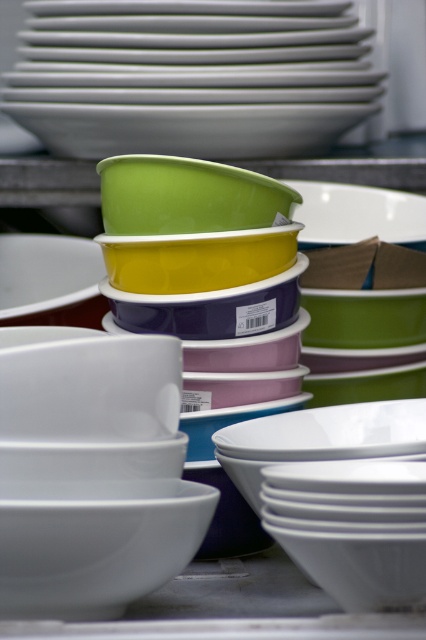
Is matte green bowl at upper center wider than white glossy bowl at center?

Yes, matte green bowl at upper center is wider than white glossy bowl at center.

Between matte green bowl at upper center and white glossy bowl at center, which one has more height?

With more height is matte green bowl at upper center.

Who is more forward, (x=347, y=234) or (x=80, y=586)?

Positioned in front is point (x=80, y=586).

Where is `matte green bowl at upper center`? matte green bowl at upper center is located at coordinates [360, 276].

Is white glossy bowl at center thinner than green glossy bowl at center?

Yes.

Between white glossy bowl at center and green glossy bowl at center, which one has less height?

green glossy bowl at center

Is point (32, 582) positioned after point (112, 196)?

No, it is not.

Locate an element on the screen. The height and width of the screenshot is (640, 426). white glossy bowl at center is located at coordinates (95, 550).

Can you confirm if matte green bowl at upper center is bigger than green glossy bowl at center?

Yes, matte green bowl at upper center is bigger than green glossy bowl at center.

Which is in front, point (394, 177) or point (166, 225)?

Positioned in front is point (166, 225).

Is point (287, 173) closer to viewer compared to point (143, 209)?

No, it is not.

Identify the location of matte green bowl at upper center. 360,276.